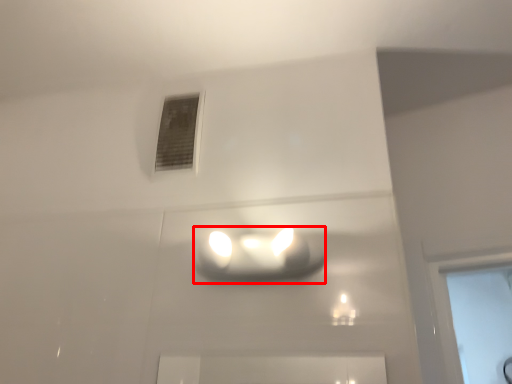
Question: From the image's perspective, where is lamp (annotated by the red box) located in relation to window in the image?

Choices:
 (A) above
 (B) below

Answer: (B)